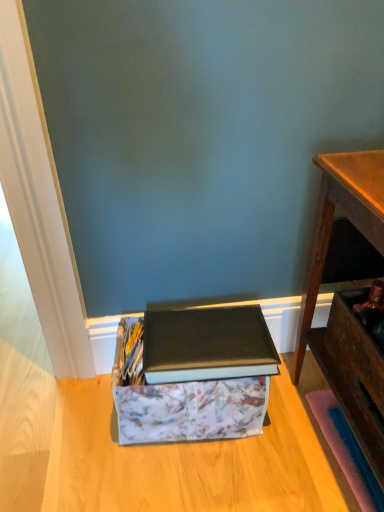
Identify the location of free location in front of floral fabric storage box at lower center. The width and height of the screenshot is (384, 512). (194, 478).